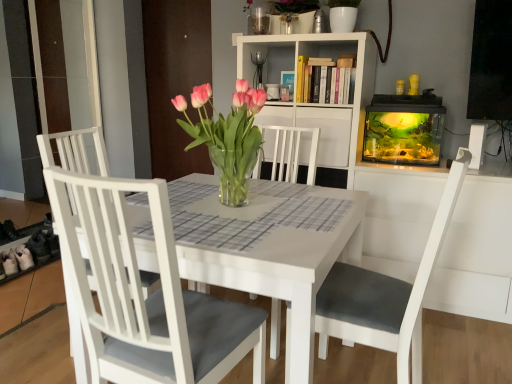
Question: In the image, is transparent glass aquarium at right positioned in front of or behind white matte chair at left, which is the second chair from right to left?

Choices:
 (A) behind
 (B) front

Answer: (A)

Question: Looking at the image, does transparent glass aquarium at right seem bigger or smaller compared to white matte chair at left, placed as the 1th chair when sorted from left to right?

Choices:
 (A) big
 (B) small

Answer: (B)

Question: Which of these objects is positioned farthest from the white wood shelf at upper center?

Choices:
 (A) white matte chair at left, placed as the 1th chair when sorted from left to right
 (B) white matte chair at center, which appears as the 1th chair when viewed from the right
 (C) transparent glass aquarium at right
 (D) pink glass vase at center
 (E) white wood bookshelf at upper center

Answer: (B)

Question: Based on their relative distances, which object is farther from the white matte chair at left, placed as the 1th chair when sorted from left to right?

Choices:
 (A) transparent glass aquarium at right
 (B) white wood shelf at upper center
 (C) pink glass vase at center
 (D) white matte chair at center, which appears as the 1th chair when viewed from the right
 (E) white wood bookshelf at upper center

Answer: (A)